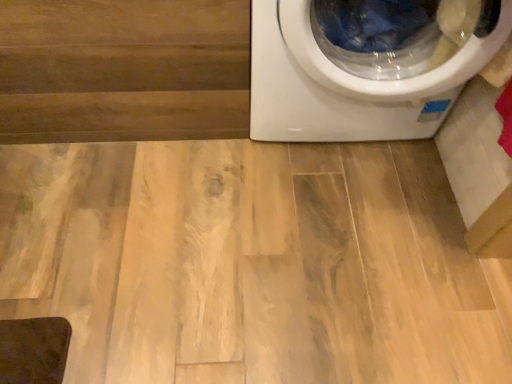
This screenshot has height=384, width=512. What do you see at coordinates (350, 82) in the screenshot?
I see `white glossy washing machine at right` at bounding box center [350, 82].

The height and width of the screenshot is (384, 512). What are the coordinates of `white glossy washing machine at right` in the screenshot? It's located at (350, 82).

Identify the location of white glossy washing machine at right. (350, 82).